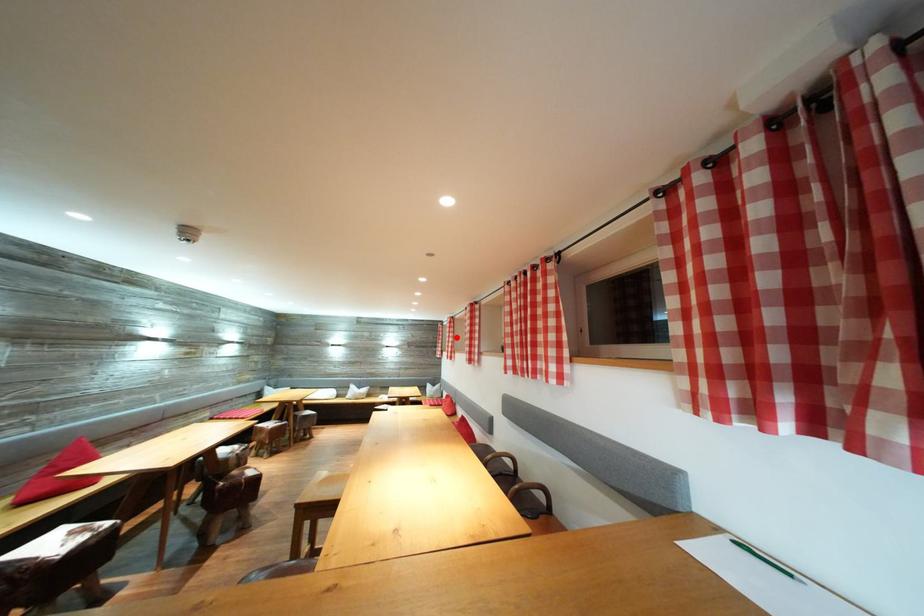
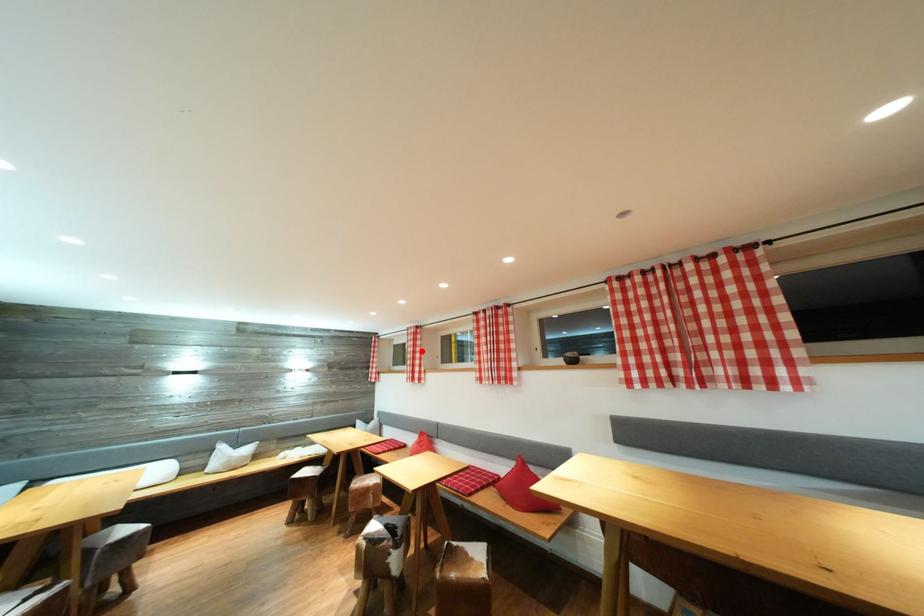
I am providing you with two images of the same scene from different viewpoints. A red point is marked on the first image and another point is marked on the second image. Are the points marked in image1 and image2 representing the same 3D position?

Yes